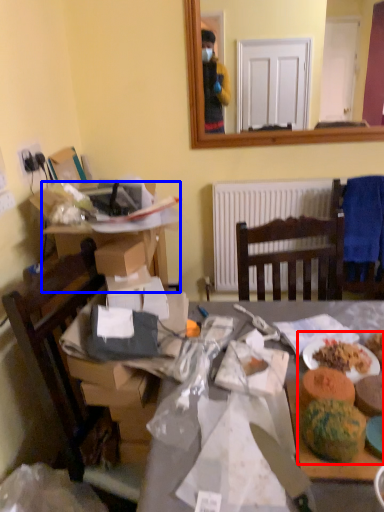
Question: Among these objects, which one is farthest to the camera, food (highlighted by a red box) or desk (highlighted by a blue box)?

Choices:
 (A) food
 (B) desk

Answer: (B)